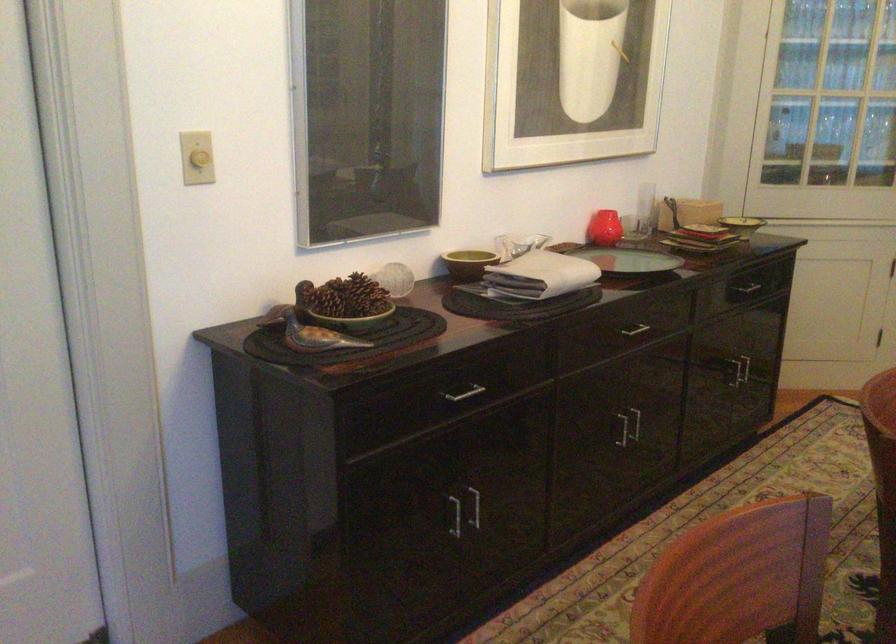
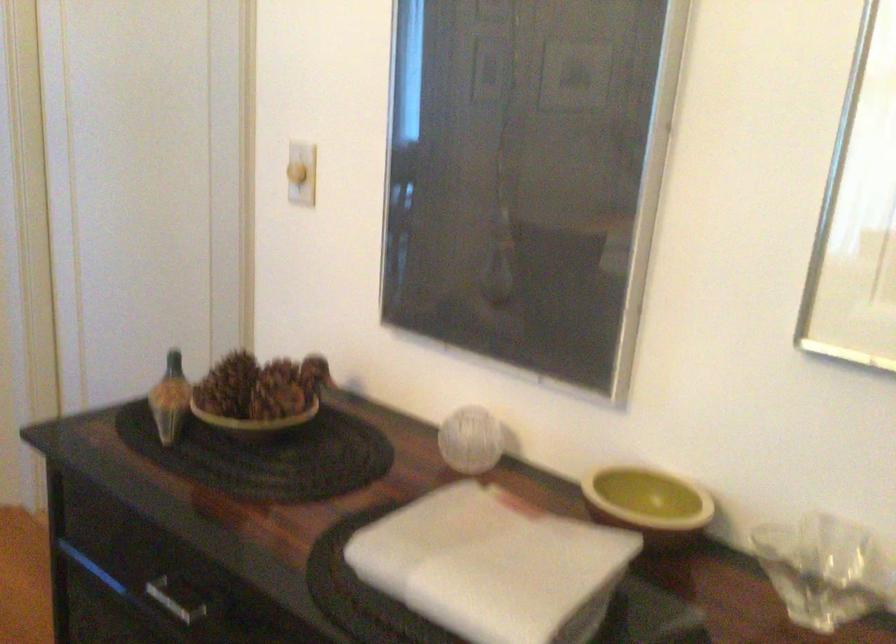
Locate, in the second image, the point that corresponds to point (452, 393) in the first image.

(177, 598)